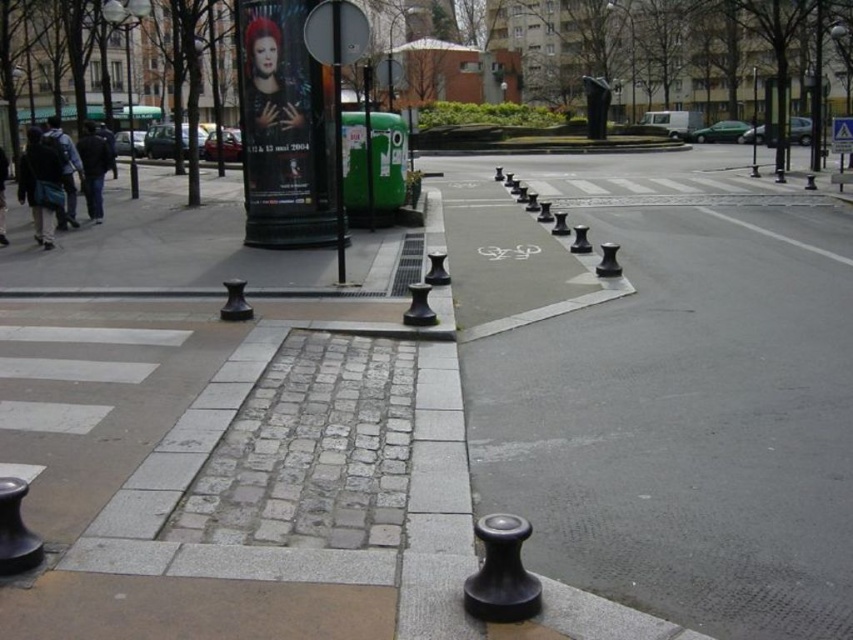
You are a delivery person trying to navigate a narrow alley between the black rubber bollards at center and the metallic pole at center. Can you pass through the space between them?

The black rubber bollards at center is located below the metallic pole at center, so there is vertical space between them. However, since the question mentions navigating a narrow alley, which implies horizontal space, the vertical positioning does not ensure horizontal clearance. Therefore, it is uncertain if you can pass through the space between them without more information about their horizontal distance.

You are a delivery person who needs to place a 7 meter long box between the black rubber bollards at center and the metallic pole at center. Can the box fit in the space between them?

The black rubber bollards at center and metallic pole at center are 6.95 meters apart from each other. Since the box is 7 meters long, it is slightly longer than the available space, so the box cannot fit between them.